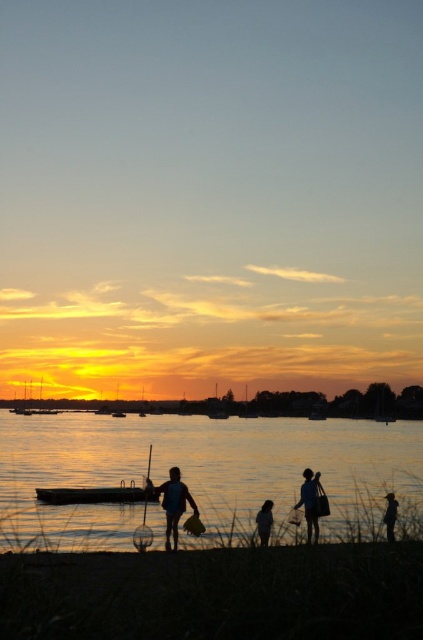
Can you confirm if dark sand at lower center is taller than silhouette figure at lower right?

Yes.

Is dark sand at lower center to the right of silhouette figure at lower right from the viewer's perspective?

In fact, dark sand at lower center is to the left of silhouette figure at lower right.

Is point (335, 636) closer to viewer compared to point (384, 522)?

Yes, it is in front of point (384, 522).

Locate an element on the screen. dark sand at lower center is located at coordinates (216, 593).

Between wooden canoe at center and silhouette fabric person at lower center, which one appears on the right side from the viewer's perspective?

silhouette fabric person at lower center

Is the position of wooden canoe at center more distant than that of silhouette fabric person at lower center?

Yes, wooden canoe at center is behind silhouette fabric person at lower center.

Between point (109, 488) and point (257, 516), which one is positioned in front?

Point (257, 516)

At what (x,y) coordinates should I click in order to perform the action: click on wooden canoe at center. Please return your answer as a coordinate pair (x, y). Looking at the image, I should click on (96, 493).

Can you confirm if silhouette swimmer at center is positioned to the left of silhouette backpack at lower right?

Correct, you'll find silhouette swimmer at center to the left of silhouette backpack at lower right.

Who is more distant from viewer, (178, 470) or (301, 499)?

The point (301, 499) is behind.

Between point (195, 504) and point (302, 474), which one is positioned behind?

The point (302, 474) is more distant.

Where is `silhouette swimmer at center`? The width and height of the screenshot is (423, 640). silhouette swimmer at center is located at coordinates (175, 504).